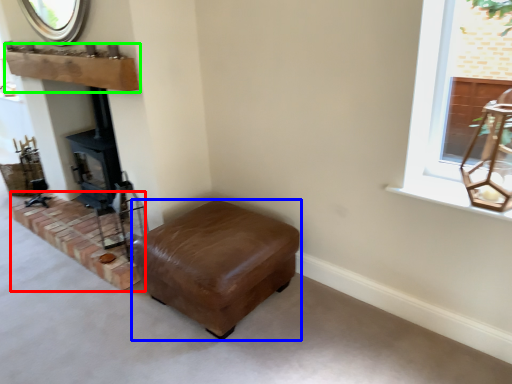
Question: Which is nearer to the brickwork (highlighted by a red box)? furniture (highlighted by a blue box) or mantle (highlighted by a green box).

Choices:
 (A) furniture
 (B) mantle

Answer: (A)